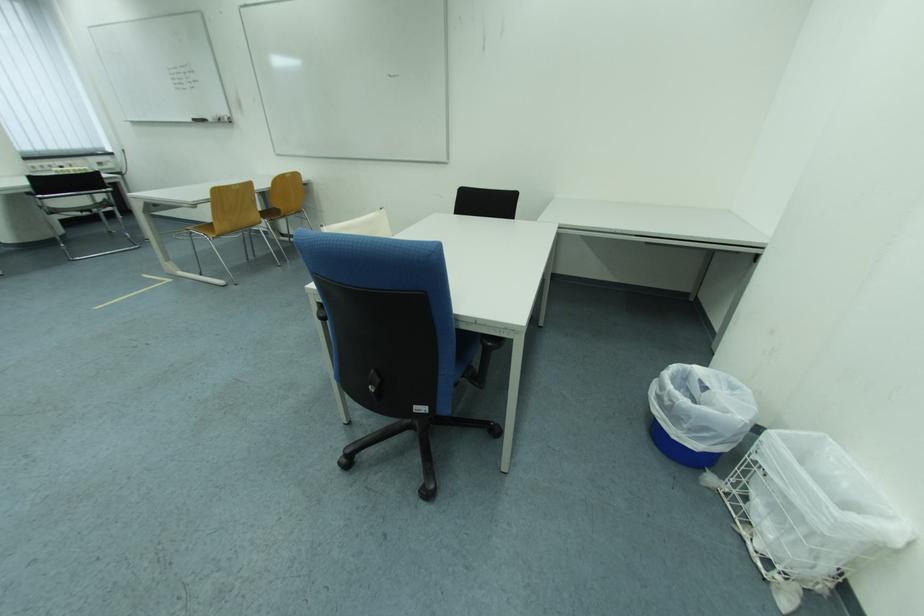
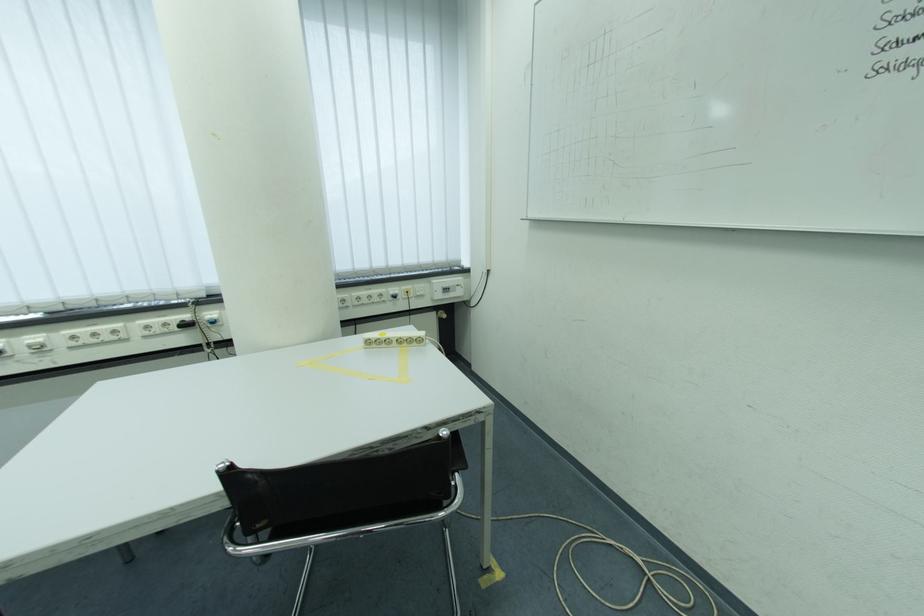
Locate, in the second image, the point that corresponds to point (67, 166) in the first image.

(402, 291)